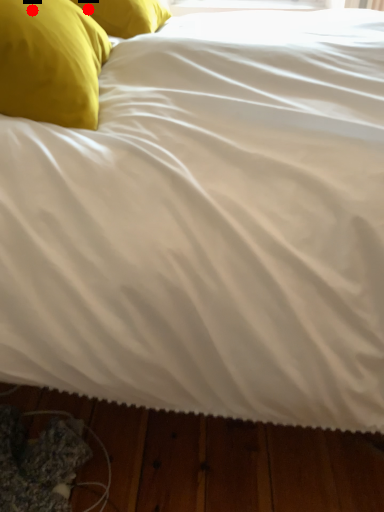
Question: Two points are circled on the image, labeled by A and B beside each circle. Which point is further to the camera?

Choices:
 (A) A is further
 (B) B is further

Answer: (B)